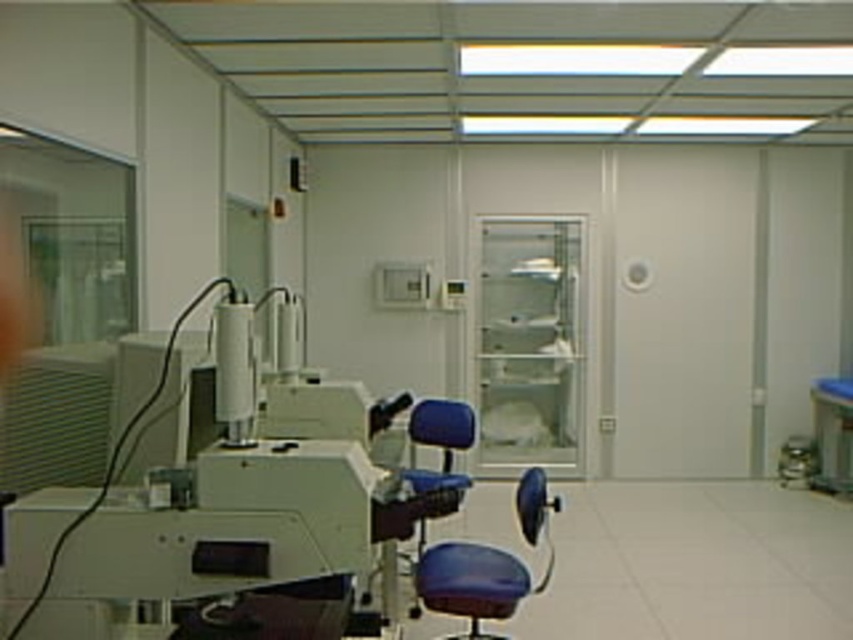
You are a researcher who needs to sit in one of the chairs at the center of the lab. The lab requires that you maintain a minimum distance of 1 meter between yourself and any other person. If another researcher is already sitting in the matte blue chair at center, can you safely sit in the blue leather swivel chair at center?

The blue leather swivel chair at center is 1.15 meters away from the matte blue chair at center. Since the minimum required distance is 1 meter, you can safely sit in the blue leather swivel chair at center as the distance exceeds the requirement.

You are standing in the laboratory and want to determine which of the two points, point (445, 584) or point (450, 449), is closer to you. Based on the image, which point is nearer?

Point (445, 584) is closer to the camera than point (450, 449), so it is the nearer point.